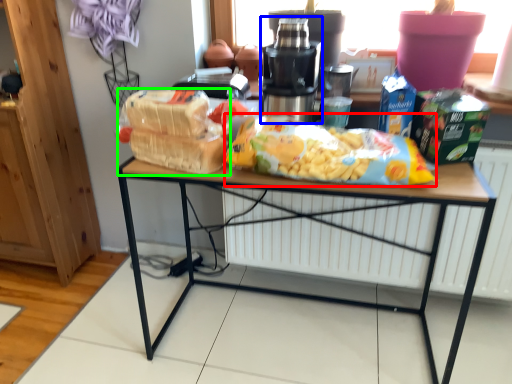
Question: Considering the real-world distances, which object is closest to cereal (highlighted by a red box)? tableware (highlighted by a blue box) or snack (highlighted by a green box).

Choices:
 (A) tableware
 (B) snack

Answer: (A)